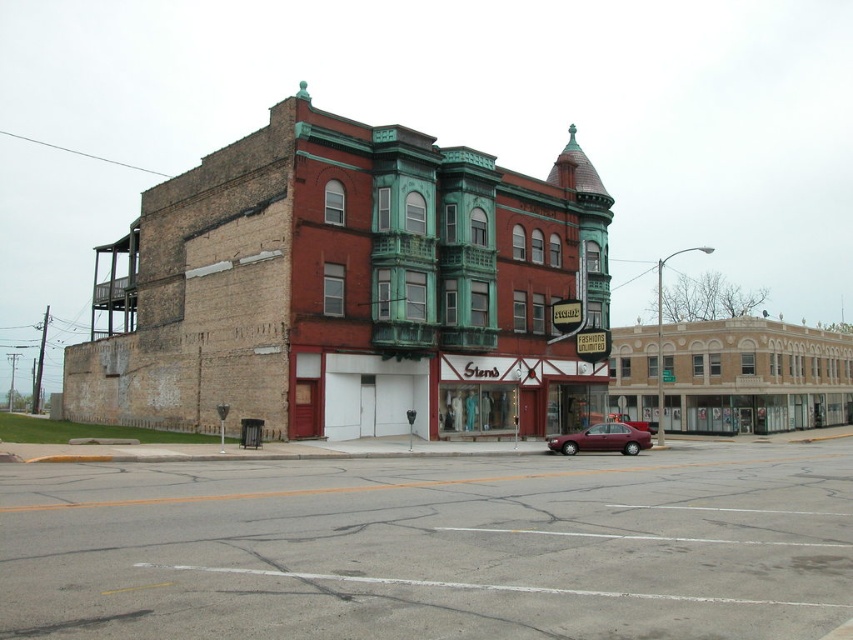
Question: Is asphalt road at center thinner than maroon metallic sedan at center?

Choices:
 (A) yes
 (B) no

Answer: (B)

Question: Which point is farther to the camera?

Choices:
 (A) (561, 444)
 (B) (334, 522)

Answer: (A)

Question: Is asphalt road at center closer to camera compared to maroon metallic sedan at center?

Choices:
 (A) no
 (B) yes

Answer: (B)

Question: Is asphalt road at center above maroon metallic sedan at center?

Choices:
 (A) yes
 (B) no

Answer: (A)